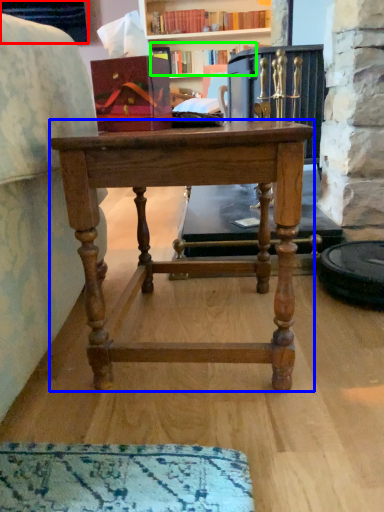
Question: Based on their relative distances, which object is farther from cabinetry (highlighted by a red box)? Choose from desk (highlighted by a blue box) and book (highlighted by a green box).

Choices:
 (A) desk
 (B) book

Answer: (A)